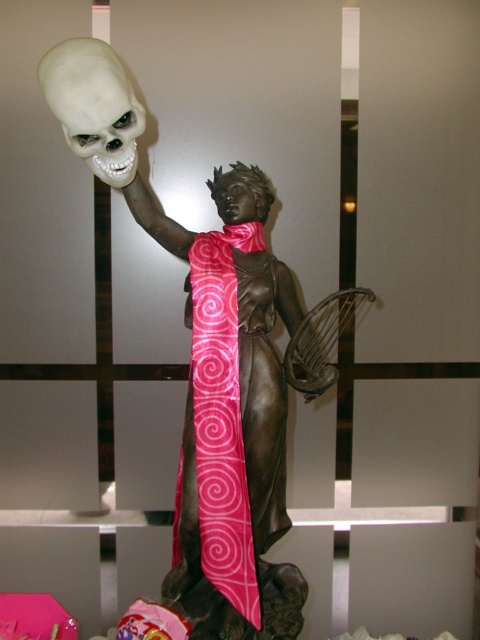
Question: Does bronze statue at center have a greater width compared to white matte skull at upper left?

Choices:
 (A) yes
 (B) no

Answer: (A)

Question: Estimate the real-world distances between objects in this image. Which object is farther from the bronze statue at center?

Choices:
 (A) pink silk tie at center
 (B) white matte skull at upper left

Answer: (B)

Question: Can you confirm if pink silk tie at center is positioned above white matte skull at upper left?

Choices:
 (A) no
 (B) yes

Answer: (A)

Question: Which object is the farthest from the bronze statue at center?

Choices:
 (A) pink silk tie at center
 (B) white matte skull at upper left

Answer: (B)

Question: Does bronze statue at center have a lesser width compared to pink silk tie at center?

Choices:
 (A) no
 (B) yes

Answer: (A)

Question: Which point appears farthest from the camera in this image?

Choices:
 (A) (115, 163)
 (B) (127, 90)
 (C) (213, 515)

Answer: (C)